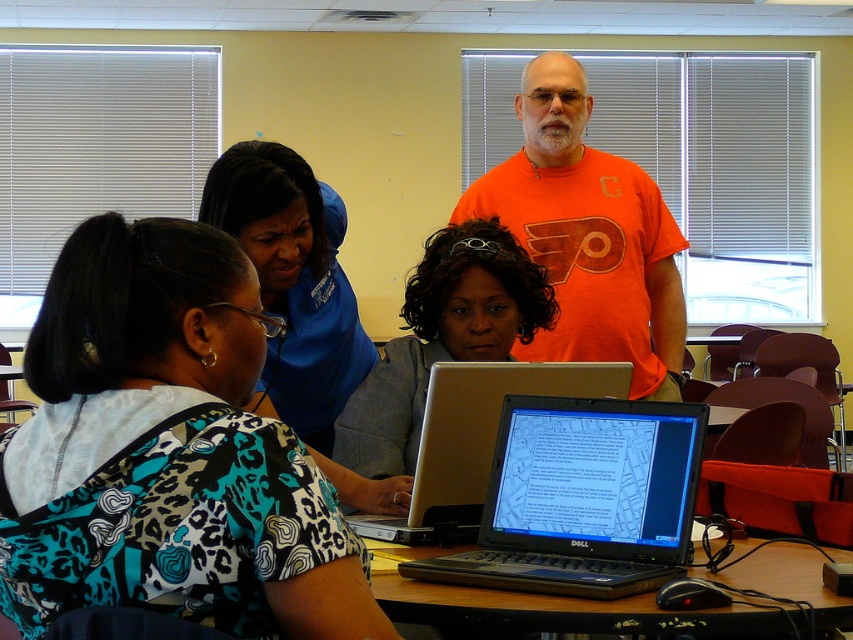
You are organizing a small event and need to place a 1.2 meter wide banner on the table. Given the printed fabric shirt at center and the black plastic table at center, which object can accommodate the banner based on their widths?

The black plastic table at center can accommodate the 1.2 meter wide banner since it has a greater width than the printed fabric shirt at center.

You are a photographer standing in the classroom and want to take a picture of the blue fabric shirt at upper center and the black plastic table at center. Which object should you focus on first if you want to capture both in the same frame without moving the camera?

The blue fabric shirt at upper center is above the black plastic table at center, so you should focus on the blue fabric shirt at upper center first to ensure both are in the frame.

You are a photographer standing in the classroom. You need to capture a photo that includes both the blue fabric shirt at upper center and the black plastic table at center. Which object should you focus on first to ensure both are in frame?

The blue fabric shirt at upper center has a larger size compared to the black plastic table at center, so you should focus on the blue fabric shirt at upper center first to ensure both are in frame.